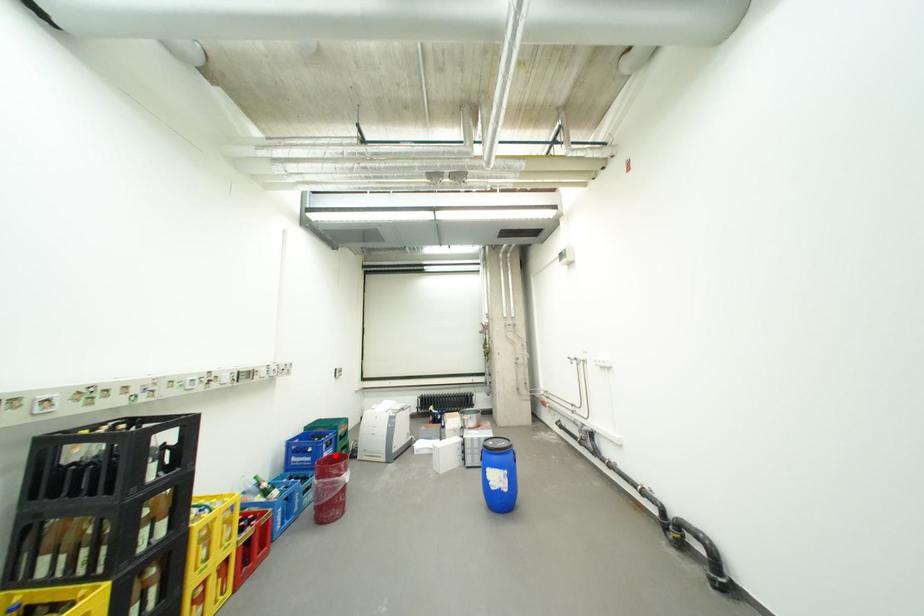
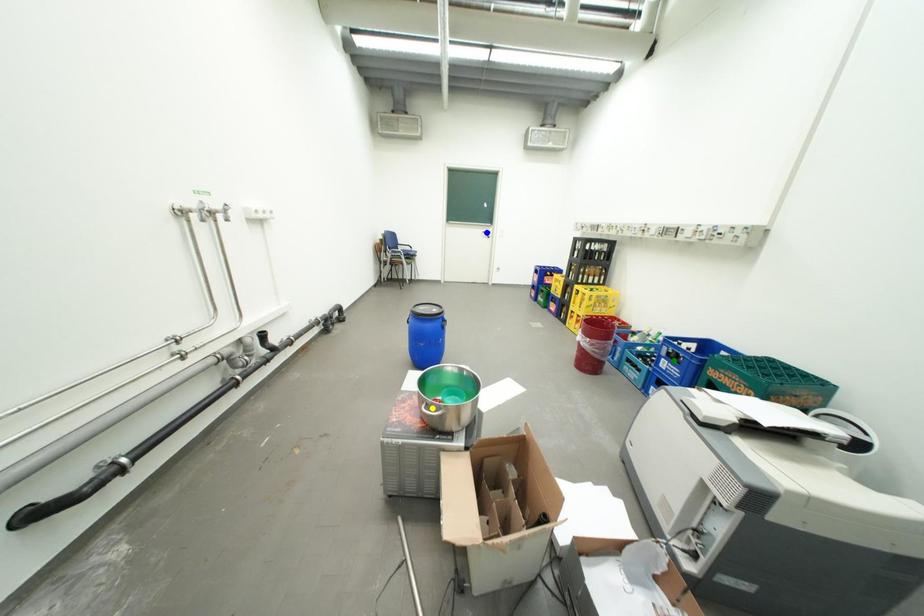
Question: I am providing you with two images of the same scene from different viewpoints. A red point is marked on the first image. You are given multiple points on the second image. Can you choose the point in image 2 that corresponds to the point in image 1?

Choices:
 (A) green point
 (B) yellow point
 (C) blue point

Answer: (A)